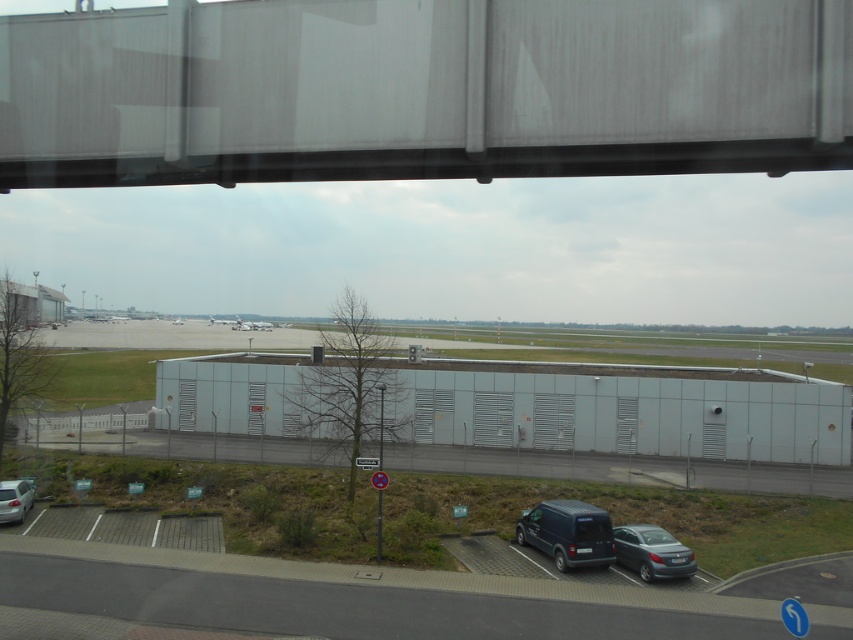
Question: Can you confirm if gray metallic building at center is positioned to the left of silver metallic airplane at center?

Choices:
 (A) yes
 (B) no

Answer: (B)

Question: Which object is closer to the camera taking this photo?

Choices:
 (A) silver metallic airplane at center
 (B) metallic silver airplane at center

Answer: (A)

Question: Is silver metallic van at lower left bigger than silver metallic airplane at center?

Choices:
 (A) yes
 (B) no

Answer: (B)

Question: Which of the following is the farthest from the observer?

Choices:
 (A) metallic gray sedan at lower right
 (B) dark gray matte van at lower right

Answer: (B)

Question: Does metallic gray overpass at upper center have a greater width compared to metallic gray sedan at lower right?

Choices:
 (A) no
 (B) yes

Answer: (B)

Question: Which point is farther from the camera taking this photo?

Choices:
 (A) (550, 552)
 (B) (231, 320)
 (C) (161, 612)

Answer: (B)